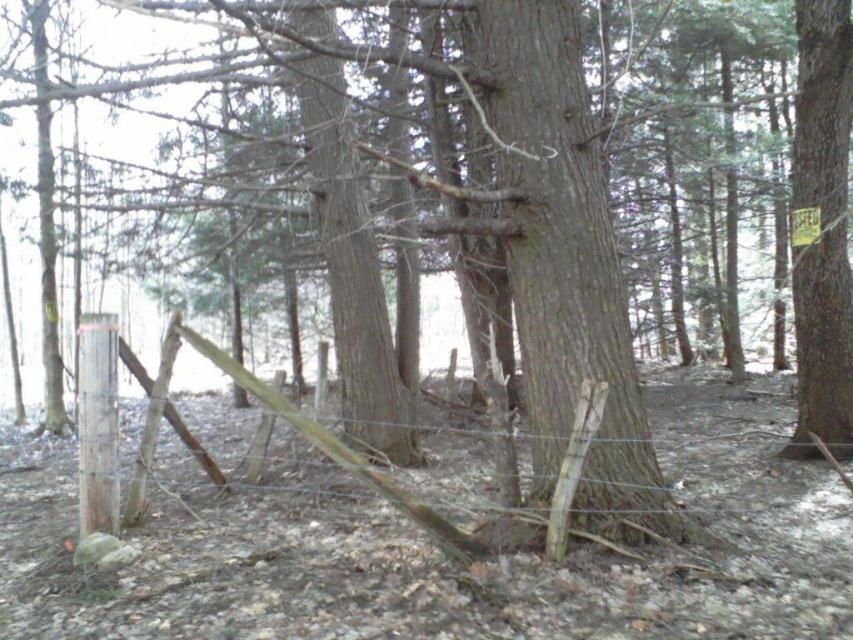
Who is more forward, (831,193) or (169,368)?

Point (169,368)

Who is more distant from viewer, (831,212) or (548,541)?

The point (831,212) is more distant.

You are a GUI agent. You are given a task and a screenshot of the screen. Output one action in this format:
    pyautogui.click(x=<x>, y=<y>)
    Task: Click on the smooth brown tree trunk at right
    
    Given the screenshot: What is the action you would take?
    pyautogui.click(x=822, y=228)